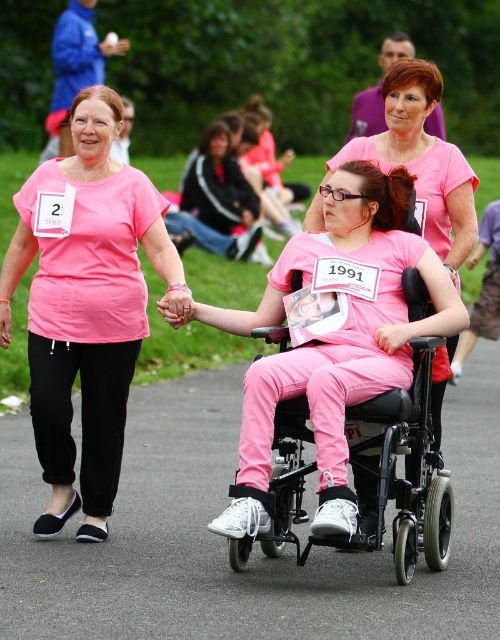
Question: Considering the real-world distances, which object is farthest from the matte pink shirt at left?

Choices:
 (A) pink matte wheelchair at center
 (B) pink fabric pants at center
 (C) metallic black wheelchair at center

Answer: (B)

Question: Does matte pink shirt at left appear over metallic black wheelchair at center?

Choices:
 (A) yes
 (B) no

Answer: (A)

Question: Which object is the closest to the matte pink shirt at left?

Choices:
 (A) metallic black wheelchair at center
 (B) pink fabric pants at center

Answer: (A)

Question: Considering the relative positions of pink fabric pants at center and matte pink shirt at left in the image provided, where is pink fabric pants at center located with respect to matte pink shirt at left?

Choices:
 (A) right
 (B) left

Answer: (A)

Question: Which object is positioned farthest from the pink matte wheelchair at center?

Choices:
 (A) metallic black wheelchair at center
 (B) matte pink shirt at left

Answer: (B)

Question: Does matte pink shirt at left appear on the right side of pink matte wheelchair at center?

Choices:
 (A) yes
 (B) no

Answer: (B)